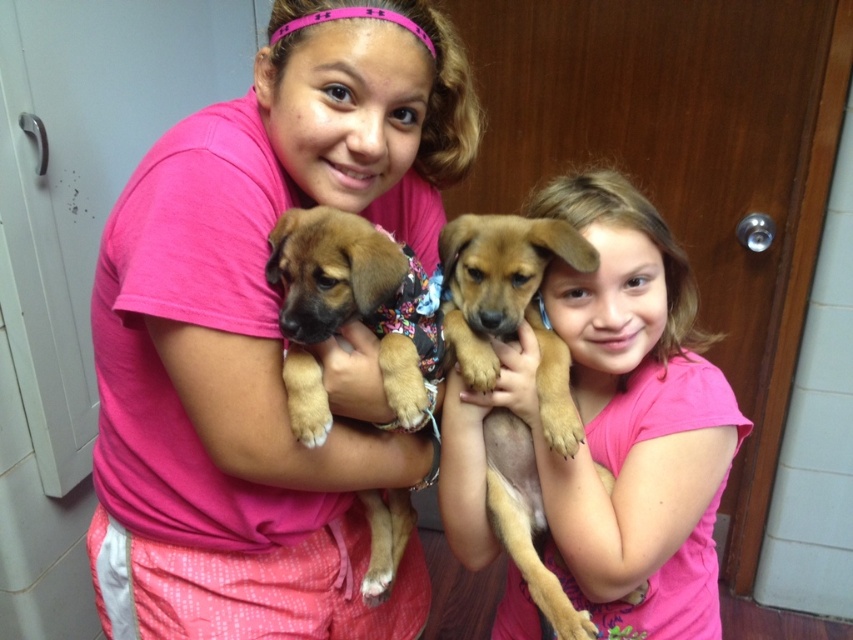
Does pink fabric shirt at center have a smaller size compared to brown furry dog at center?

No.

Identify the location of pink fabric shirt at center. The image size is (853, 640). (263, 340).

What do you see at coordinates (263, 340) in the screenshot?
I see `pink fabric shirt at center` at bounding box center [263, 340].

Identify the location of pink fabric shirt at center. (263, 340).

Is brown furry dog at center bigger than brown soft fur puppy at center?

Indeed, brown furry dog at center has a larger size compared to brown soft fur puppy at center.

Which is behind, point (561, 342) or point (407, 317)?

Positioned behind is point (561, 342).

You are a GUI agent. You are given a task and a screenshot of the screen. Output one action in this format:
    pyautogui.click(x=<x>, y=<y>)
    Task: Click on the brown furry dog at center
    
    Given the screenshot: What is the action you would take?
    pyautogui.click(x=509, y=305)

The height and width of the screenshot is (640, 853). I want to click on pink fabric shirt at center, so click(x=263, y=340).

Is pink fabric shirt at center below brown soft fur puppy at center?

Indeed, pink fabric shirt at center is positioned under brown soft fur puppy at center.

The width and height of the screenshot is (853, 640). I want to click on pink fabric shirt at center, so click(x=263, y=340).

Find the location of a particular element. This screenshot has width=853, height=640. pink fabric shirt at center is located at coordinates (263, 340).